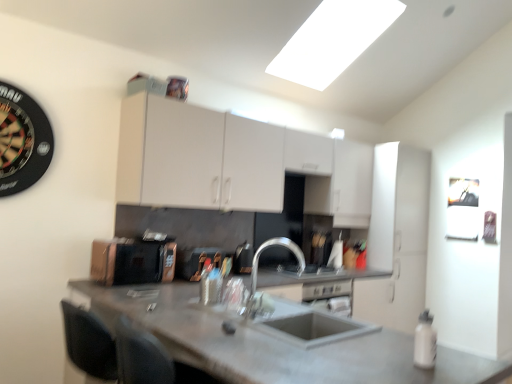
Image resolution: width=512 pixels, height=384 pixels. Find the location of `vacant space to the right of white matte bottle at lower right`. vacant space to the right of white matte bottle at lower right is located at coordinates (471, 356).